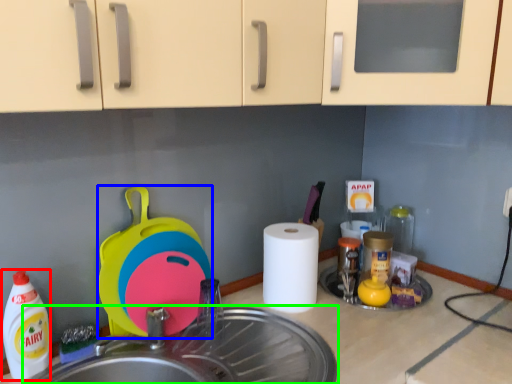
Question: Based on their relative distances, which object is farther from cleaning product (highlighted by a red box)? Choose from appliance (highlighted by a blue box) and sink (highlighted by a green box).

Choices:
 (A) appliance
 (B) sink

Answer: (B)